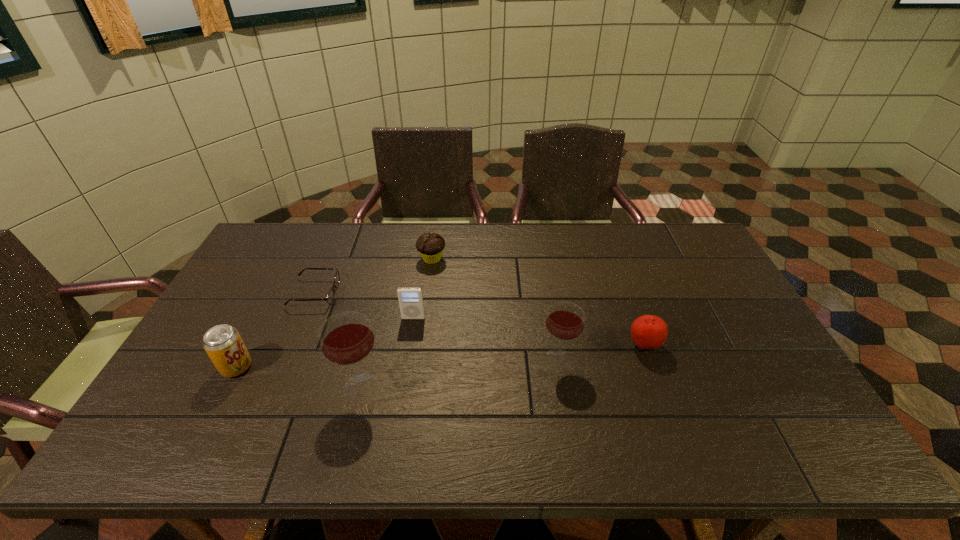
All wineglasss are currently evenly spaced. To continue this pattern, where would you add another wineglass on the right? Please point out a vacant spot. Please provide its 2D coordinates. Your answer should be formatted as a tuple, i.e. [(x, y)], where the tuple contains the x and y coordinates of a point satisfying the conditions above.

[(734, 334)]